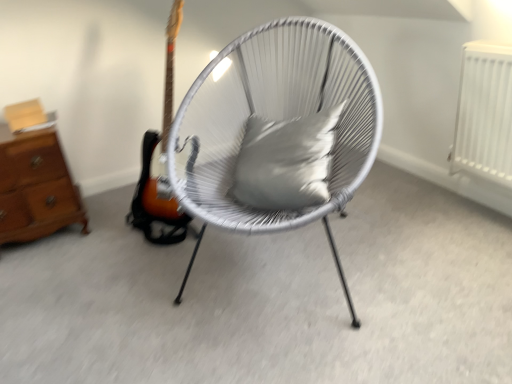
The width and height of the screenshot is (512, 384). What do you see at coordinates (273, 119) in the screenshot?
I see `white woven chair at center` at bounding box center [273, 119].

The width and height of the screenshot is (512, 384). I want to click on brown wooden chest of drawers at left, so click(x=36, y=188).

From the image's perspective, is white woven chair at center beneath satin gray pillow at center?

Yes, from the image's perspective, white woven chair at center is below satin gray pillow at center.

Is white woven chair at center looking in the opposite direction of satin gray pillow at center?

That's right, white woven chair at center is facing away from satin gray pillow at center.

Considering the points (207, 75) and (260, 172), which point is in front, point (207, 75) or point (260, 172)?

The point (260, 172) is in front.

Is white woven chair at center a part of satin gray pillow at center?

No, white woven chair at center is not a part of satin gray pillow at center.

Is satin gray pillow at center directly adjacent to white woven chair at center?

satin gray pillow at center and white woven chair at center are clearly separated.

Is satin gray pillow at center turned away from white woven chair at center?

Yes, white woven chair at center is at the back of satin gray pillow at center.

Considering the sizes of satin gray pillow at center and white woven chair at center in the image, is satin gray pillow at center wider or thinner than white woven chair at center?

Considering their sizes, satin gray pillow at center looks slimmer than white woven chair at center.

Which object is more forward, white woven chair at center or brown wooden chest of drawers at left?

white woven chair at center is more forward.

Does point (373, 81) come behind point (32, 188)?

No, (373, 81) is closer to viewer.

From the image's perspective, is white woven chair at center on brown wooden chest of drawers at left?

Yes, from the image's perspective, white woven chair at center is on top of brown wooden chest of drawers at left.

Would you say white woven chair at center is inside or outside brown wooden chest of drawers at left?

white woven chair at center is located beyond the bounds of brown wooden chest of drawers at left.

Considering the sizes of satin gray pillow at center and brown wooden chest of drawers at left in the image, is satin gray pillow at center bigger or smaller than brown wooden chest of drawers at left?

Considering their sizes, satin gray pillow at center takes up less space than brown wooden chest of drawers at left.

Is satin gray pillow at center situated inside brown wooden chest of drawers at left or outside?

satin gray pillow at center cannot be found inside brown wooden chest of drawers at left.

How much distance is there between satin gray pillow at center and brown wooden chest of drawers at left?

They are 3.28 feet apart.

Can you confirm if satin gray pillow at center is taller than brown wooden chest of drawers at left?

No, satin gray pillow at center is not taller than brown wooden chest of drawers at left.

Considering the positions of objects brown wooden chest of drawers at left and white woven chair at center in the image provided, who is more to the left, brown wooden chest of drawers at left or white woven chair at center?

Positioned to the left is brown wooden chest of drawers at left.

Between brown wooden chest of drawers at left and white woven chair at center, which one has larger width?

With larger width is white woven chair at center.

From the image's perspective, which is below, brown wooden chest of drawers at left or white woven chair at center?

brown wooden chest of drawers at left, from the image's perspective.

How distant is brown wooden chest of drawers at left from white woven chair at center?

78.89 centimeters.

Considering the positions of point (60, 192) and point (281, 182), is point (60, 192) closer or farther from the camera than point (281, 182)?

Point (60, 192) appears to be farther away from the viewer than point (281, 182).

Does brown wooden chest of drawers at left have a smaller size compared to satin gray pillow at center?

No.

Find the location of a particular element. The height and width of the screenshot is (384, 512). pillow above the brown wooden chest of drawers at left (from the image's perspective) is located at coordinates (x=286, y=161).

Can you tell me how much brown wooden chest of drawers at left and satin gray pillow at center differ in facing direction?

51.8 degrees.

Identify the location of pillow lying above the white woven chair at center (from the image's perspective). This screenshot has width=512, height=384. (286, 161).

Where is `chair below the satin gray pillow at center (from the image's perspective)`? The height and width of the screenshot is (384, 512). chair below the satin gray pillow at center (from the image's perspective) is located at coordinates (273, 119).

Based on their spatial positions, is brown wooden chest of drawers at left or satin gray pillow at center further from white woven chair at center?

brown wooden chest of drawers at left is positioned further to the anchor white woven chair at center.

Estimate the real-world distances between objects in this image. Which object is further from white woven chair at center, satin gray pillow at center or brown wooden chest of drawers at left?

brown wooden chest of drawers at left is further to white woven chair at center.

Estimate the real-world distances between objects in this image. Which object is further from brown wooden chest of drawers at left, white woven chair at center or satin gray pillow at center?

Based on the image, satin gray pillow at center appears to be further to brown wooden chest of drawers at left.

Estimate the real-world distances between objects in this image. Which object is further from brown wooden chest of drawers at left, satin gray pillow at center or white woven chair at center?

satin gray pillow at center lies further to brown wooden chest of drawers at left than the other object.

Considering their positions, is brown wooden chest of drawers at left positioned closer to satin gray pillow at center than white woven chair at center?

Based on the image, white woven chair at center appears to be nearer to satin gray pillow at center.

From the image, which object appears to be nearer to satin gray pillow at center, white woven chair at center or brown wooden chest of drawers at left?

The object closer to satin gray pillow at center is white woven chair at center.

This screenshot has height=384, width=512. What are the coordinates of `chair between brown wooden chest of drawers at left and satin gray pillow at center` in the screenshot? It's located at (273, 119).